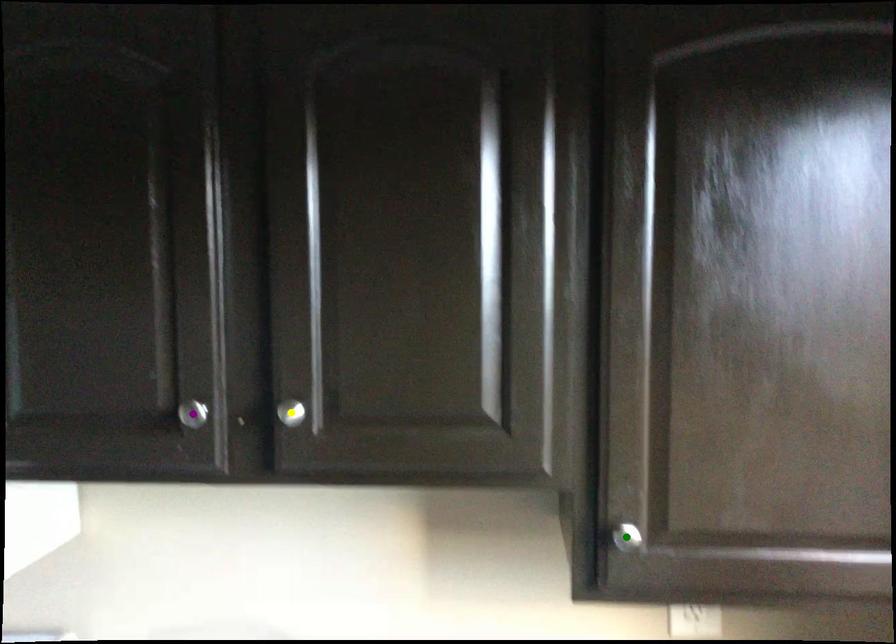
From the picture: Order these from farthest to nearest:
purple point
green point
yellow point

1. purple point
2. yellow point
3. green point